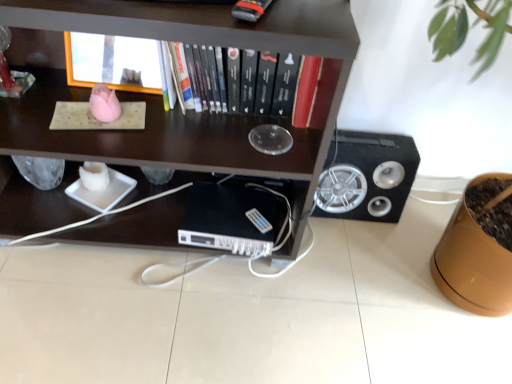
Where is `vacant area located to the right-hand side of black matte speaker at right`? This screenshot has width=512, height=384. vacant area located to the right-hand side of black matte speaker at right is located at coordinates (421, 220).